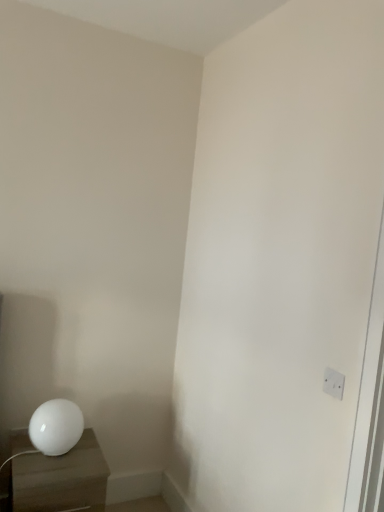
Question: In terms of height, does white glossy nightstand at lower left look taller or shorter compared to white glossy sphere at lower left?

Choices:
 (A) tall
 (B) short

Answer: (A)

Question: Relative to white glossy sphere at lower left, is white glossy nightstand at lower left in front or behind?

Choices:
 (A) behind
 (B) front

Answer: (B)

Question: Which object is the closest to the white glossy sphere at lower left?

Choices:
 (A) white plastic electric outlet at upper right
 (B) white glossy nightstand at lower left

Answer: (B)

Question: Which object is the closest to the white glossy nightstand at lower left?

Choices:
 (A) white plastic electric outlet at upper right
 (B) white glossy sphere at lower left

Answer: (B)